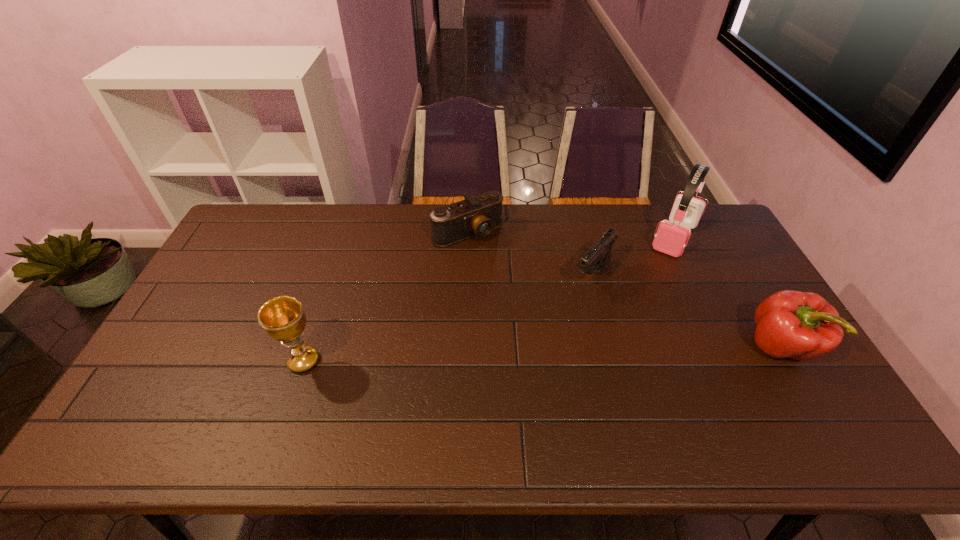
The height and width of the screenshot is (540, 960). In order to click on earphone at the right edge in this screenshot , I will do `click(671, 238)`.

This screenshot has width=960, height=540. I want to click on object present at the far right corner, so click(671, 238).

In order to click on free space at the far edge of the desktop in this screenshot , I will do `click(407, 220)`.

I want to click on free space at the near edge of the desktop, so click(x=679, y=382).

The image size is (960, 540). Find the location of `vacant area at the right edge`. vacant area at the right edge is located at coordinates (787, 369).

This screenshot has height=540, width=960. In order to click on free space at the far left corner in this screenshot , I will do `click(276, 235)`.

In the image, there is a desktop. At what (x,y) coordinates should I click in order to perform the action: click on free space at the far right corner. Please return your answer as a coordinate pair (x, y). This screenshot has height=540, width=960. Looking at the image, I should click on click(694, 237).

Identify the location of blank space at the near right corner of the desktop. The image size is (960, 540). (797, 395).

In order to click on empty space that is in between the pistol and the second object from left to right in this screenshot , I will do `click(530, 255)`.

I want to click on vacant area between the pepper and the leftmost object, so click(x=542, y=354).